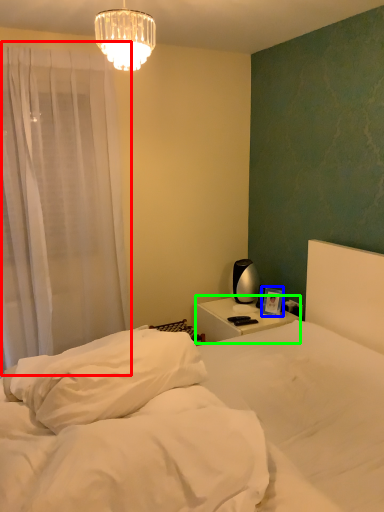
Question: Which is nearer to the curtain (highlighted by a red box)? picture frame (highlighted by a blue box) or nightstand (highlighted by a green box).

Choices:
 (A) picture frame
 (B) nightstand

Answer: (B)